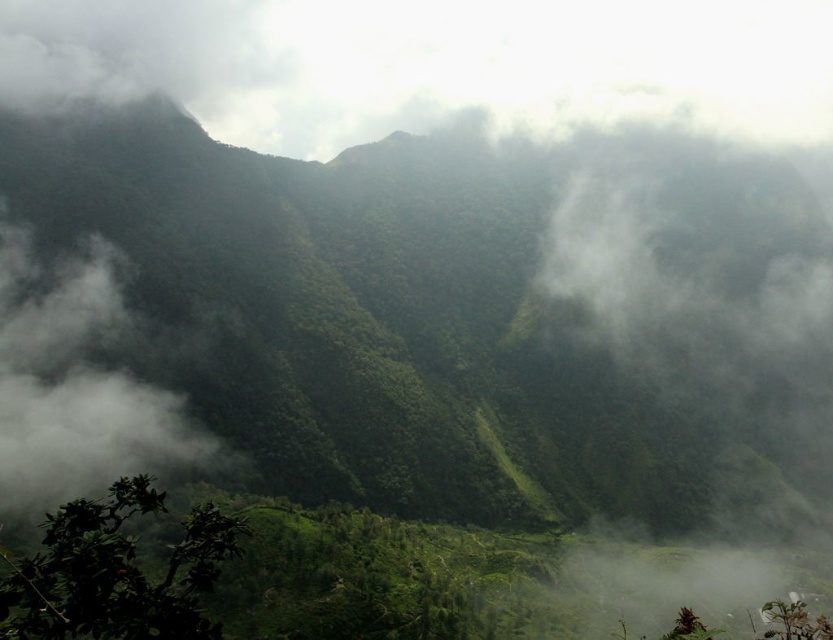
Question: Does white fluffy cloud at left come behind green leafy bush at lower left?

Choices:
 (A) yes
 (B) no

Answer: (A)

Question: Does white fluffy cloud at left appear over green leafy bush at lower left?

Choices:
 (A) yes
 (B) no

Answer: (A)

Question: Which point is closer to the camera?

Choices:
 (A) white fluffy cloud at left
 (B) green leafy bush at lower left

Answer: (B)

Question: Does white fluffy cloud at left have a lesser width compared to green leafy bush at lower left?

Choices:
 (A) yes
 (B) no

Answer: (A)